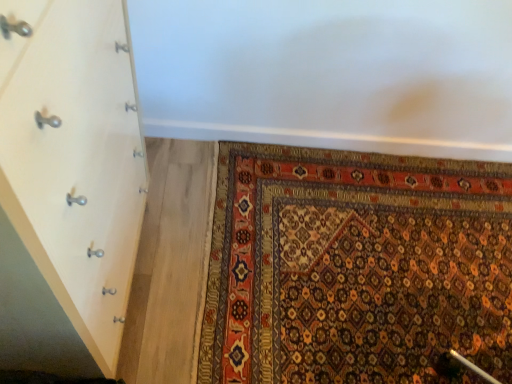
At what (x,y) coordinates should I click in order to perform the action: click on vacant location below carpet with intricate patterns at lower right (from a real-world perspective). Please return your answer as a coordinate pair (x, y). The height and width of the screenshot is (384, 512). Looking at the image, I should click on (376, 247).